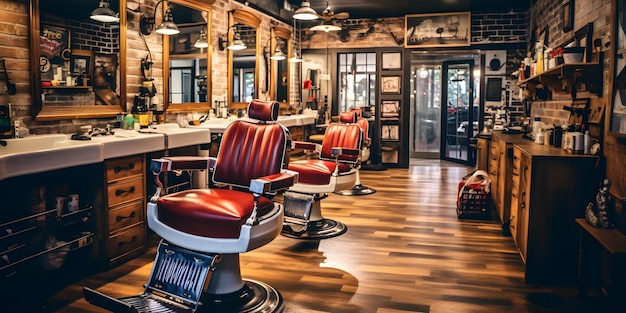
You are a GUI agent. You are given a task and a screenshot of the screen. Output one action in this format:
    pyautogui.click(x=<x>, y=<y>)
    Task: Click on the base of chair
    
    Given the screenshot: What is the action you would take?
    pyautogui.click(x=227, y=298), pyautogui.click(x=314, y=219), pyautogui.click(x=369, y=190)